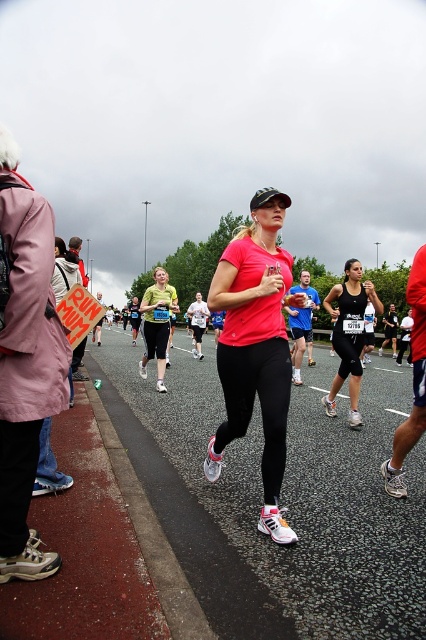
Between black matte tank top at center and wooden signboard at left, which one is positioned lower?

black matte tank top at center

Between black matte tank top at center and wooden signboard at left, which one has less height?

black matte tank top at center is shorter.

This screenshot has width=426, height=640. What do you see at coordinates (348, 333) in the screenshot? I see `black matte tank top at center` at bounding box center [348, 333].

Where is `black matte tank top at center`? black matte tank top at center is located at coordinates (348, 333).

Between point (224, 349) and point (293, 348), which one is positioned behind?

Point (293, 348)

Does matte pink shirt at center appear on the left side of blue fabric shirt at center?

Indeed, matte pink shirt at center is positioned on the left side of blue fabric shirt at center.

Between point (241, 253) and point (301, 353), which one is positioned in front?

Point (241, 253) is in front.

Find the location of a particular element. This screenshot has height=640, width=426. matte pink shirt at center is located at coordinates (256, 348).

Is blue fabric shirt at center closer to the viewer compared to wooden signboard at left?

Yes, blue fabric shirt at center is closer to the viewer.

Does blue fabric shirt at center have a smaller size compared to wooden signboard at left?

Yes.

Image resolution: width=426 pixels, height=640 pixels. In order to click on blue fabric shirt at center in this screenshot , I will do (x=302, y=324).

The image size is (426, 640). Identify the location of blue fabric shirt at center. 302,324.